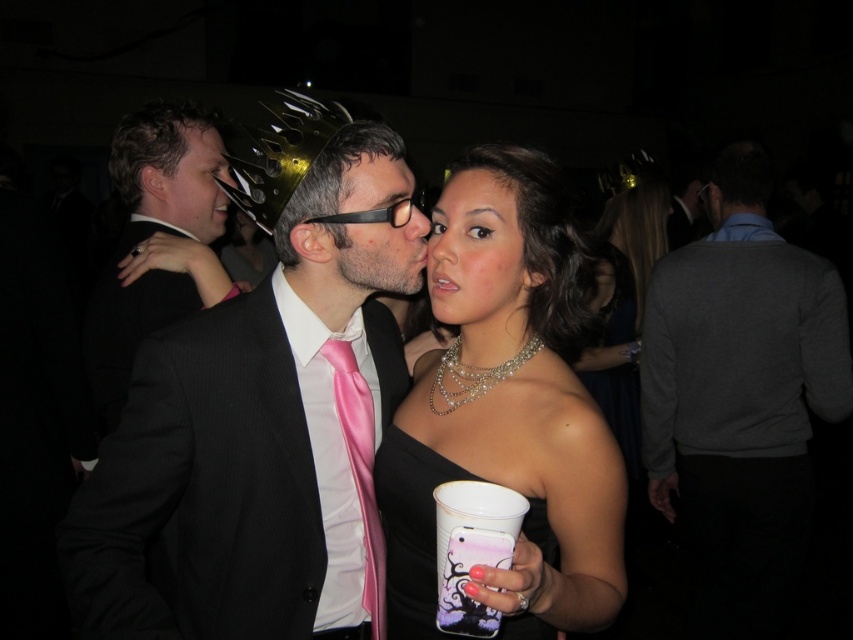
Which is more to the left, shiny black dress at center or gray sweater at center?

shiny black dress at center is more to the left.

Who is shorter, shiny black dress at center or gray sweater at center?

shiny black dress at center is shorter.

Image resolution: width=853 pixels, height=640 pixels. I want to click on shiny black dress at center, so click(506, 410).

What are the coordinates of `shiny black dress at center` in the screenshot? It's located at (506, 410).

Who is more distant from viewer, (106, 298) or (198, 204)?

The point (198, 204) is behind.

Is black satin suit at left smaller than matte black hair at left?

No.

Where is `black satin suit at left`? This screenshot has width=853, height=640. black satin suit at left is located at coordinates (155, 241).

Is point (422, 586) positioned before point (181, 221)?

Yes, point (422, 586) is closer to viewer.

Who is more forward, (517,257) or (207,157)?

Point (517,257)

Which is behind, point (469, 388) or point (192, 134)?

The point (192, 134) is more distant.

Find the location of a particular element. shiny black dress at center is located at coordinates (506, 410).